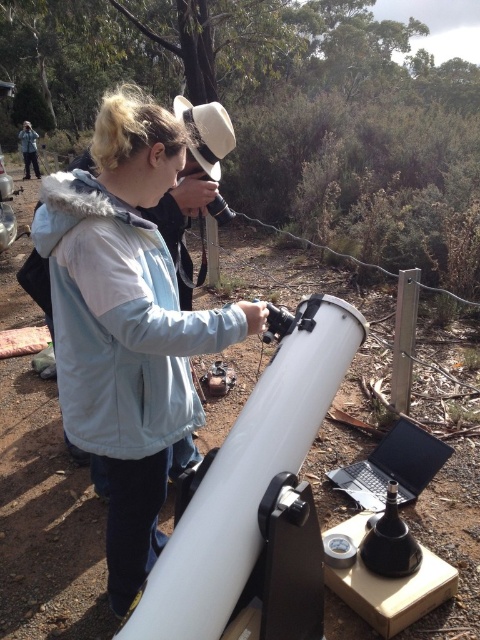
You are a delivery robot that needs to place a 1.2 meter long package between the matte white telescope at center and the black plastic laptop at lower right. Can you fit the package between them without moving either object?

The distance between the matte white telescope at center and the black plastic laptop at lower right is 1.14 meters. Since the package is 1.2 meters long, it cannot fit between them without moving either object.

You are setting up a portable workstation near the telescope. You have a black plastic laptop at lower right and a matte black jacket at upper left. Which item takes up less horizontal space?

The black plastic laptop at lower right has a lesser width compared to the matte black jacket at upper left, so the black plastic laptop at lower right takes up less horizontal space.